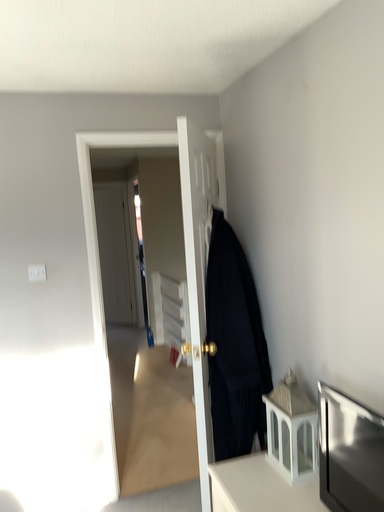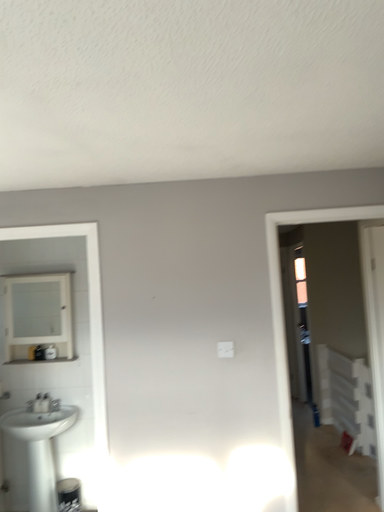
Question: Which way did the camera rotate in the video?

Choices:
 (A) rotated upward
 (B) rotated downward

Answer: (A)